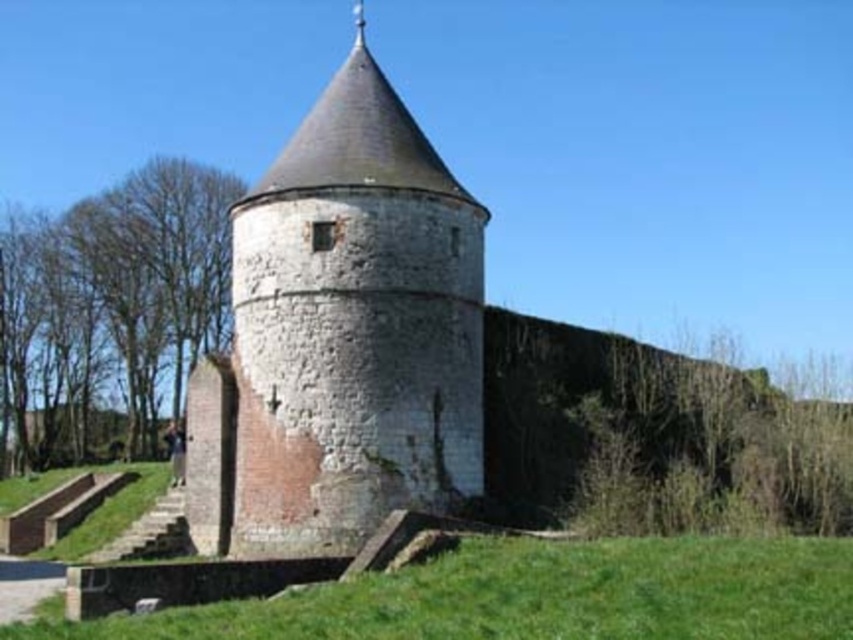
You are standing on the green grass at lower center, looking up at the white stone tower at center. Which object is taller?

The white stone tower at center is taller than the green grass at lower center.

You are standing in a field and see the white stone tower at center and the green grass at lower center. Which object is closer to you?

The white stone tower at center is closer to you than the green grass at lower center because it is further to the viewer.

You are standing on the green grass at lower center looking up at the white stone tower at center. Which object is higher in your field of view?

The white stone tower at center is higher in your field of view than the green grass at lower center because it is positioned above it.